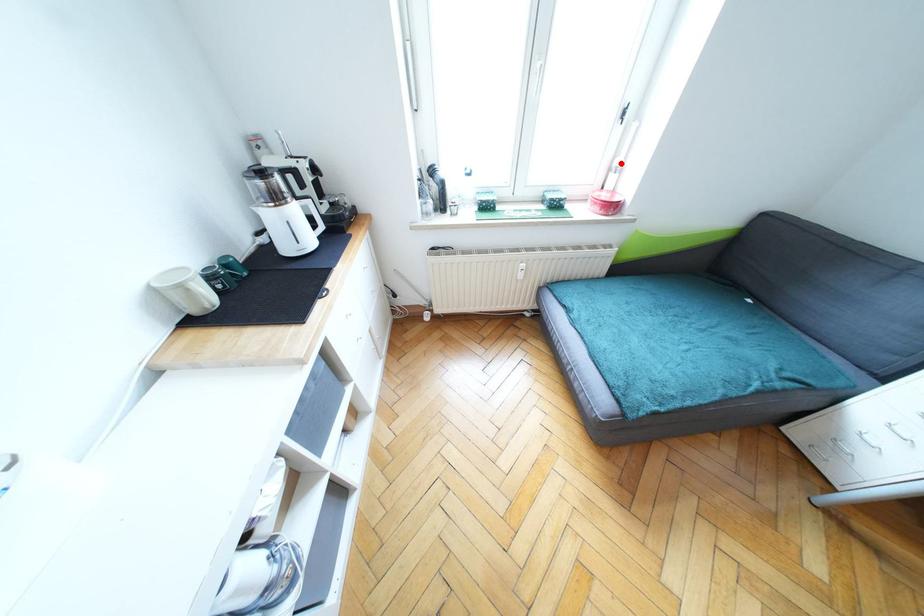
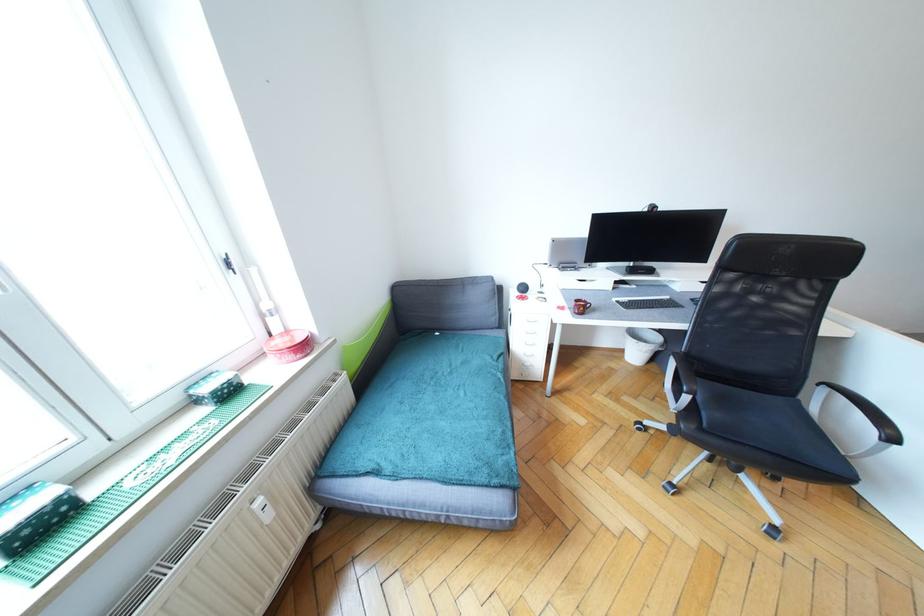
Locate, in the second image, the point that corresponds to the highlighted location in the first image.

(270, 307)